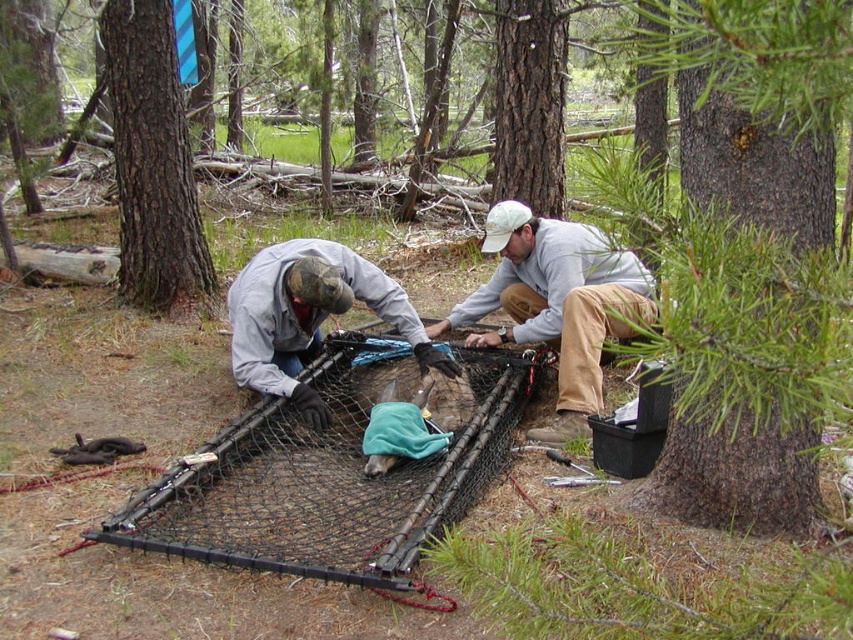
Question: Is light gray cotton shirt at center in front of camouflage fabric hat at center?

Choices:
 (A) yes
 (B) no

Answer: (B)

Question: Is black mesh net at center in front of brown rough bark tree at upper left?

Choices:
 (A) yes
 (B) no

Answer: (A)

Question: Is light gray cotton shirt at center bigger than camouflage fabric hat at center?

Choices:
 (A) no
 (B) yes

Answer: (B)

Question: Which point is closer to the camera?

Choices:
 (A) light gray cotton shirt at center
 (B) camouflage fabric hat at center
 (C) brown rough bark tree at center

Answer: (B)

Question: Which object appears farthest from the camera in this image?

Choices:
 (A) green needle-like leaves at center
 (B) brown rough bark tree at upper left

Answer: (B)

Question: Estimate the real-world distances between objects in this image. Which object is farther from the green needle-like leaves at center?

Choices:
 (A) brown rough bark tree at upper left
 (B) light gray cotton shirt at center
 (C) camouflage fabric hat at center
 (D) brown rough bark tree at center

Answer: (D)